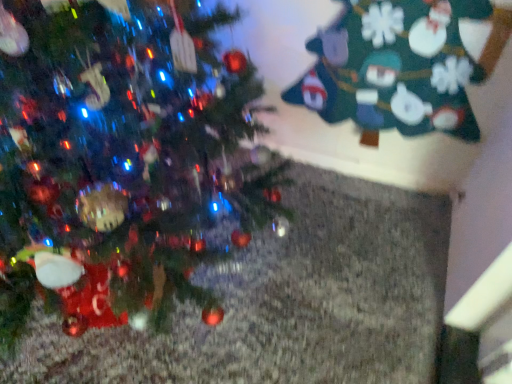
Question: Is green felt christmas tree at upper right, which appears as the 1th christmas tree when viewed from the right, inside the boundaries of green matte christmas tree at left, the 1th christmas tree when ordered from left to right, or outside?

Choices:
 (A) inside
 (B) outside

Answer: (B)

Question: Considering the relative positions of green felt christmas tree at upper right, which appears as the 1th christmas tree when viewed from the right, and green matte christmas tree at left, the 2th christmas tree viewed from the right, in the image provided, is green felt christmas tree at upper right, which appears as the 1th christmas tree when viewed from the right, to the left or to the right of green matte christmas tree at left, the 2th christmas tree viewed from the right,?

Choices:
 (A) right
 (B) left

Answer: (A)

Question: In terms of width, does green felt christmas tree at upper right, which appears as the 1th christmas tree when viewed from the right, look wider or thinner when compared to green matte christmas tree at left, the 1th christmas tree when ordered from left to right?

Choices:
 (A) wide
 (B) thin

Answer: (B)

Question: Is point (13, 150) positioned closer to the camera than point (377, 124)?

Choices:
 (A) farther
 (B) closer

Answer: (B)

Question: From the image's perspective, is green matte christmas tree at left, the 2th christmas tree viewed from the right, positioned above or below green felt christmas tree at upper right, which is the 2th christmas tree from left to right?

Choices:
 (A) below
 (B) above

Answer: (A)

Question: Considering their positions, is green matte christmas tree at left, the 2th christmas tree viewed from the right, located in front of or behind green felt christmas tree at upper right, which appears as the 1th christmas tree when viewed from the right?

Choices:
 (A) behind
 (B) front

Answer: (B)

Question: Based on their sizes in the image, would you say green matte christmas tree at left, the 2th christmas tree viewed from the right, is bigger or smaller than green felt christmas tree at upper right, which appears as the 1th christmas tree when viewed from the right?

Choices:
 (A) big
 (B) small

Answer: (A)